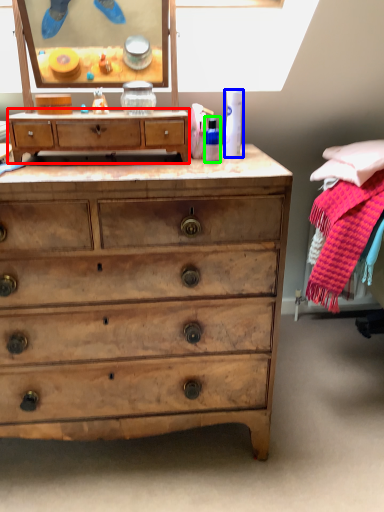
Question: Which is nearer to the chest of drawers (highlighted by a red box)? toiletry (highlighted by a blue box) or toiletry (highlighted by a green box).

Choices:
 (A) toiletry
 (B) toiletry

Answer: (B)